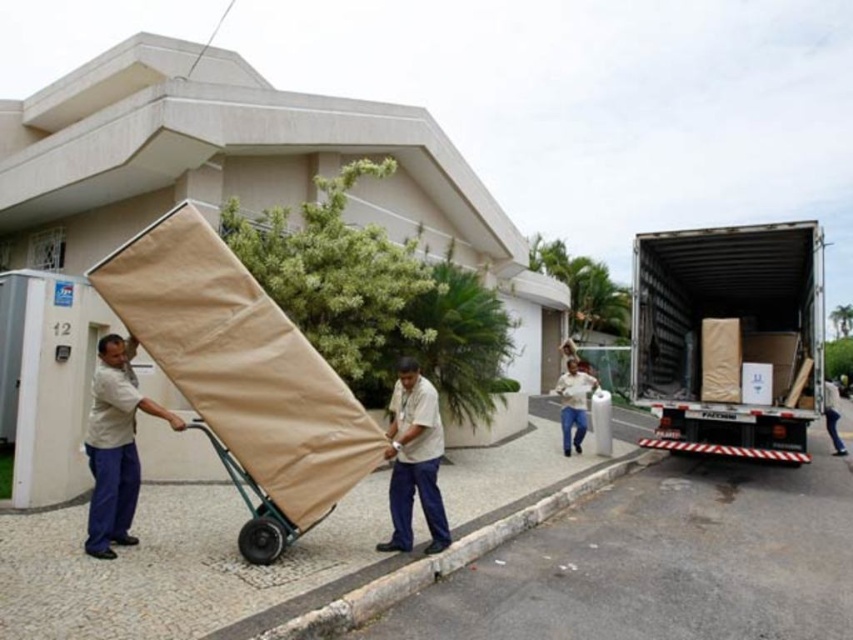
Can you confirm if light brown fabric at center is taller than white cotton shirt at center?

No.

Is point (427, 490) positioned behind point (569, 374)?

No, it is in front of (569, 374).

Image resolution: width=853 pixels, height=640 pixels. I want to click on light brown fabric at center, so click(x=415, y=460).

In the scene shown: Between light beige fabric at left and light brown fabric at center, which one is positioned lower?

light brown fabric at center is lower down.

Between point (100, 480) and point (410, 486), which one is positioned in front?

Point (100, 480)

Where is `light beige fabric at left`? light beige fabric at left is located at coordinates (115, 445).

Describe the element at coordinates (115, 445) in the screenshot. I see `light beige fabric at left` at that location.

The image size is (853, 640). In order to click on light beige fabric at left in this screenshot , I will do `click(115, 445)`.

Who is more distant from viewer, (154, 416) or (579, 424)?

Point (579, 424)

Locate an element on the screen. The height and width of the screenshot is (640, 853). light beige fabric at left is located at coordinates point(115,445).